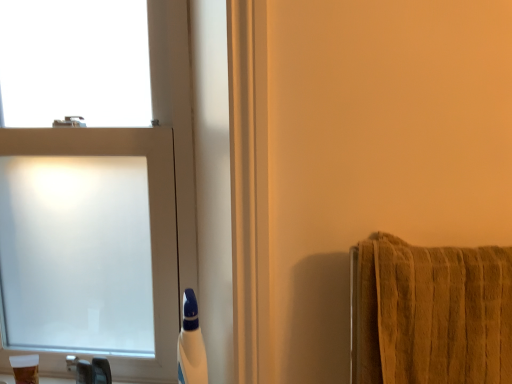
Question: Would you say white plastic bottle at lower center, the first toiletry in the right-to-left sequence, is to the left or to the right of translucent plastic cup at lower left, positioned as the first toiletry in left-to-right order, in the picture?

Choices:
 (A) left
 (B) right

Answer: (B)

Question: Considering their positions, is white plastic bottle at lower center, the first toiletry in the right-to-left sequence, located in front of or behind translucent plastic cup at lower left, positioned as the first toiletry in left-to-right order?

Choices:
 (A) front
 (B) behind

Answer: (A)

Question: Estimate the real-world distances between objects in this image. Which object is closer to the translucent plastic cup at lower left, positioned as the first toiletry in left-to-right order?

Choices:
 (A) white plastic bottle at lower center, which is the second toiletry from left to right
 (B) brushed metal faucet at lower left
 (C) frosted glass window at left

Answer: (B)

Question: Which of these objects is positioned farthest from the translucent plastic cup at lower left, arranged as the second toiletry when viewed from the right?

Choices:
 (A) brushed metal faucet at lower left
 (B) frosted glass window at left
 (C) white plastic bottle at lower center, the first toiletry in the right-to-left sequence

Answer: (B)